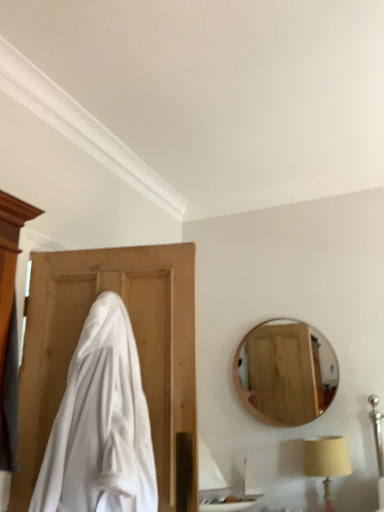
Question: Should I look upward or downward to see beige fabric lampshade at lower right?

Choices:
 (A) up
 (B) down

Answer: (B)

Question: Is beige fabric lampshade at lower right oriented towards white glossy sink at lower center?

Choices:
 (A) no
 (B) yes

Answer: (A)

Question: Is the depth of beige fabric lampshade at lower right greater than that of white glossy sink at lower center?

Choices:
 (A) yes
 (B) no

Answer: (B)

Question: Is beige fabric lampshade at lower right turned away from white glossy sink at lower center?

Choices:
 (A) yes
 (B) no

Answer: (B)

Question: Is beige fabric lampshade at lower right shorter than white glossy sink at lower center?

Choices:
 (A) yes
 (B) no

Answer: (A)

Question: Considering the relative sizes of beige fabric lampshade at lower right and white glossy sink at lower center in the image provided, is beige fabric lampshade at lower right thinner than white glossy sink at lower center?

Choices:
 (A) no
 (B) yes

Answer: (B)

Question: Is beige fabric lampshade at lower right surrounding white glossy sink at lower center?

Choices:
 (A) yes
 (B) no

Answer: (B)

Question: Can you confirm if white glossy sink at lower center is shorter than white cloth at left?

Choices:
 (A) yes
 (B) no

Answer: (A)

Question: Is the position of white glossy sink at lower center more distant than that of white cloth at left?

Choices:
 (A) yes
 (B) no

Answer: (A)

Question: Considering the relative sizes of white glossy sink at lower center and white cloth at left in the image provided, is white glossy sink at lower center smaller than white cloth at left?

Choices:
 (A) yes
 (B) no

Answer: (A)

Question: From a real-world perspective, is white glossy sink at lower center located beneath white cloth at left?

Choices:
 (A) no
 (B) yes

Answer: (B)

Question: Is white glossy sink at lower center far from white cloth at left?

Choices:
 (A) no
 (B) yes

Answer: (B)

Question: Is white glossy sink at lower center aimed at white cloth at left?

Choices:
 (A) no
 (B) yes

Answer: (B)

Question: From a real-world perspective, is beige fabric lampshade at lower right beneath white cloth at left?

Choices:
 (A) yes
 (B) no

Answer: (A)